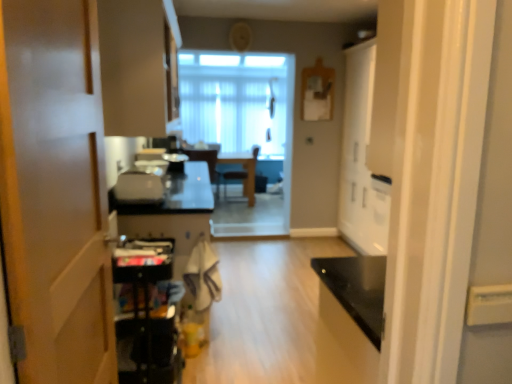
Measure the distance between point (277, 130) and camera.

Point (277, 130) is 7.15 meters from camera.

In order to face satin black toaster at center, which is the first appliance in top-to-bottom order, should I rotate leftwards or rightwards?

A 10.558 degree turn to the left will do.

The height and width of the screenshot is (384, 512). What do you see at coordinates (175, 162) in the screenshot?
I see `satin black toaster at center, which is the first appliance in top-to-bottom order` at bounding box center [175, 162].

You are a GUI agent. You are given a task and a screenshot of the screen. Output one action in this format:
    pyautogui.click(x=<x>, y=<y>)
    Task: Click on the matte white chair at center, which is the first chair in left-to-right order
    Image resolution: width=512 pixels, height=384 pixels.
    Given the screenshot: What is the action you would take?
    pyautogui.click(x=205, y=160)

Consider the image. From a real-world perspective, is satin silver toaster at center, placed as the 2th appliance when sorted from bottom to top, on top of wooden chair at center, acting as the second chair starting from the left?

Correct, in the physical world, satin silver toaster at center, placed as the 2th appliance when sorted from bottom to top, is higher than wooden chair at center, acting as the second chair starting from the left.

From the image's perspective, is satin silver toaster at center, placed as the 2th appliance when sorted from bottom to top, over wooden chair at center, acting as the second chair starting from the left?

No.

Can you confirm if satin silver toaster at center, placed as the 2th appliance when sorted from bottom to top, is smaller than wooden chair at center, acting as the first chair starting from the right?

Yes, satin silver toaster at center, placed as the 2th appliance when sorted from bottom to top, is smaller than wooden chair at center, acting as the first chair starting from the right.

Where is `the 2nd appliance counting from the left side of the wooden chair at center, acting as the second chair starting from the left`? The image size is (512, 384). the 2nd appliance counting from the left side of the wooden chair at center, acting as the second chair starting from the left is located at coordinates (138, 188).

Starting from the matte white chair at center, which is the first chair in left-to-right order, which door is the 2nd one to the right? Please provide its 2D coordinates.

[(361, 159)]

Could matte white chair at center, which is the 2th chair from right to left, be considered to be inside white glossy cabinet at right, which ranks as the second door in front-to-back order?

Definitely not — matte white chair at center, which is the 2th chair from right to left, is not inside white glossy cabinet at right, which ranks as the second door in front-to-back order.

Is white glossy cabinet at right, which ranks as the second door in front-to-back order, positioned with its back to matte white chair at center, which is the first chair in left-to-right order?

No, white glossy cabinet at right, which ranks as the second door in front-to-back order,'s orientation is not away from matte white chair at center, which is the first chair in left-to-right order.

Is matte white chair at center, which is the 2th chair from right to left, next to wooden chair at center, acting as the first chair starting from the right?

No, matte white chair at center, which is the 2th chair from right to left, is not next to wooden chair at center, acting as the first chair starting from the right.

Is matte white chair at center, which is the 2th chair from right to left, taller or shorter than wooden chair at center, acting as the first chair starting from the right?

In the image, matte white chair at center, which is the 2th chair from right to left, appears to be taller than wooden chair at center, acting as the first chair starting from the right.

Is matte white chair at center, which is the 2th chair from right to left, completely or partially outside of wooden chair at center, acting as the second chair starting from the left?

Yes, matte white chair at center, which is the 2th chair from right to left, is located beyond the bounds of wooden chair at center, acting as the second chair starting from the left.

Is matte white chair at center, which is the 2th chair from right to left, at the left side of wooden chair at center, acting as the first chair starting from the right?

Yes, matte white chair at center, which is the 2th chair from right to left, is to the left of wooden chair at center, acting as the first chair starting from the right.

Does matte beige cabinet at upper left appear on the left side of satin silver toaster at center, the 2th appliance in the back-to-front sequence?

Yes.

The width and height of the screenshot is (512, 384). I want to click on cabinetry in front of the satin silver toaster at center, placed as the 2th appliance when sorted from bottom to top, so click(x=138, y=66).

Are matte beige cabinet at upper left and satin silver toaster at center, placed as the 2th appliance when sorted from bottom to top, beside each other?

No.

Which point is more distant from viewer, (173, 81) or (143, 185)?

Positioned behind is point (143, 185).

Is matte beige cabinet at upper left facing away from translucent glass window at center?

matte beige cabinet at upper left is not turned away from translucent glass window at center.

Does point (145, 116) come behind point (267, 155)?

No, (145, 116) is closer to viewer.

From the picture: Which of these two, matte beige cabinet at upper left or translucent glass window at center, stands shorter?

matte beige cabinet at upper left.

In the scene shown: Which of these two, matte beige cabinet at upper left or translucent glass window at center, is wider?

matte beige cabinet at upper left.

Who is bigger, translucent glass window at center or white glossy cabinet at right, which is the 2th door in left-to-right order?

white glossy cabinet at right, which is the 2th door in left-to-right order.

Is translucent glass window at center positioned with its back to white glossy cabinet at right, the 1th door when ordered from back to front?

No, white glossy cabinet at right, the 1th door when ordered from back to front, is not at the back of translucent glass window at center.

Is the surface of translucent glass window at center in direct contact with white glossy cabinet at right, positioned as the 1th door in right-to-left order?

translucent glass window at center and white glossy cabinet at right, positioned as the 1th door in right-to-left order, are not in contact.

In the scene shown: Considering the sizes of objects metallic black cart at lower left, which appears as the third appliance when viewed from the top, and satin silver toaster at center, positioned as the 2th appliance in top-to-bottom order, in the image provided, who is bigger, metallic black cart at lower left, which appears as the third appliance when viewed from the top, or satin silver toaster at center, positioned as the 2th appliance in top-to-bottom order,?

With larger size is metallic black cart at lower left, which appears as the third appliance when viewed from the top.

Considering the positions of objects metallic black cart at lower left, which appears as the third appliance when viewed from the top, and satin silver toaster at center, the second appliance viewed from the front, in the image provided, who is behind, metallic black cart at lower left, which appears as the third appliance when viewed from the top, or satin silver toaster at center, the second appliance viewed from the front,?

satin silver toaster at center, the second appliance viewed from the front, is more distant.

Is metallic black cart at lower left, which appears as the third appliance when viewed from the top, to the left or to the right of satin silver toaster at center, the 2th appliance in the back-to-front sequence, in the image?

metallic black cart at lower left, which appears as the third appliance when viewed from the top, is positioned on satin silver toaster at center, the 2th appliance in the back-to-front sequence,'s right side.

From the picture: Considering the sizes of objects metallic black cart at lower left, placed as the first appliance when sorted from front to back, and satin silver toaster at center, positioned as the 2th appliance in top-to-bottom order, in the image provided, who is wider, metallic black cart at lower left, placed as the first appliance when sorted from front to back, or satin silver toaster at center, positioned as the 2th appliance in top-to-bottom order,?

metallic black cart at lower left, placed as the first appliance when sorted from front to back.

At what (x,y) coordinates should I click in order to perform the action: click on chair on the right of satin silver toaster at center, the second appliance viewed from the front. Please return your answer as a coordinate pair (x, y). This screenshot has height=384, width=512. Looking at the image, I should click on (243, 171).

Where is `door that is above the matte white chair at center, which is the first chair in left-to-right order (from the image's perspective)`? The image size is (512, 384). door that is above the matte white chair at center, which is the first chair in left-to-right order (from the image's perspective) is located at coordinates (361, 159).

Considering their positions, is matte wood door at left, the 1th door viewed from the front, positioned closer to matte beige cabinet at upper left than satin silver toaster at center, placed as the 2th appliance when sorted from bottom to top?

satin silver toaster at center, placed as the 2th appliance when sorted from bottom to top, is positioned closer to the anchor matte beige cabinet at upper left.

When comparing their distances from satin black toaster at center, which is the first appliance in top-to-bottom order, does metallic black cart at lower left, placed as the first appliance when sorted from front to back, or white glossy cabinet at right, which is the 2th door in left-to-right order, seem closer?

metallic black cart at lower left, placed as the first appliance when sorted from front to back, is closer to satin black toaster at center, which is the first appliance in top-to-bottom order.

Estimate the real-world distances between objects in this image. Which object is closer to translucent glass window at center, matte white chair at center, which is the 2th chair from right to left, or matte beige cabinet at upper left?

Among the two, matte white chair at center, which is the 2th chair from right to left, is located nearer to translucent glass window at center.

Considering their positions, is matte wood door at left, which appears as the second door when viewed from the right, positioned further to metallic black cart at lower left, positioned as the 1th appliance in bottom-to-top order, than wooden chair at center, acting as the second chair starting from the left?

wooden chair at center, acting as the second chair starting from the left.

From the image, which object appears to be farther from wooden chair at center, acting as the first chair starting from the right, matte wood door at left, the first door positioned from the left, or matte white chair at center, which is the 2th chair from right to left?

matte wood door at left, the first door positioned from the left.

Based on their spatial positions, is matte white chair at center, which is the 2th chair from right to left, or white glossy cabinet at right, the 1th door when ordered from back to front, closer to translucent glass window at center?

The object closer to translucent glass window at center is matte white chair at center, which is the 2th chair from right to left.

Based on their spatial positions, is matte beige cabinet at upper left or matte white chair at center, which is the first chair in left-to-right order, closer to wooden chair at center, acting as the first chair starting from the right?

matte white chair at center, which is the first chair in left-to-right order, lies closer to wooden chair at center, acting as the first chair starting from the right, than the other object.

Which object lies nearer to the anchor point matte white chair at center, which is the first chair in left-to-right order, matte beige cabinet at upper left or satin silver toaster at center, placed as the 2th appliance when sorted from bottom to top?

satin silver toaster at center, placed as the 2th appliance when sorted from bottom to top, is positioned closer to the anchor matte white chair at center, which is the first chair in left-to-right order.

You are a GUI agent. You are given a task and a screenshot of the screen. Output one action in this format:
    pyautogui.click(x=<x>, y=<y>)
    Task: Click on the appliance located between white glossy cabinet at right, which is the 2th door in left-to-right order, and translucent glass window at center in the depth direction
    The image size is (512, 384).
    Given the screenshot: What is the action you would take?
    pyautogui.click(x=175, y=162)

Image resolution: width=512 pixels, height=384 pixels. Find the location of `cabinetry located between matte wood door at left, which appears as the second door when viewed from the right, and wooden chair at center, acting as the first chair starting from the right, in the depth direction`. cabinetry located between matte wood door at left, which appears as the second door when viewed from the right, and wooden chair at center, acting as the first chair starting from the right, in the depth direction is located at coordinates (138, 66).

Image resolution: width=512 pixels, height=384 pixels. In order to click on cabinetry positioned between matte wood door at left, which appears as the second door when viewed from the right, and white glossy cabinet at right, which ranks as the second door in front-to-back order, from near to far in this screenshot , I will do `click(138, 66)`.

The width and height of the screenshot is (512, 384). Identify the location of door between matte beige cabinet at upper left and translucent glass window at center along the z-axis. (361, 159).